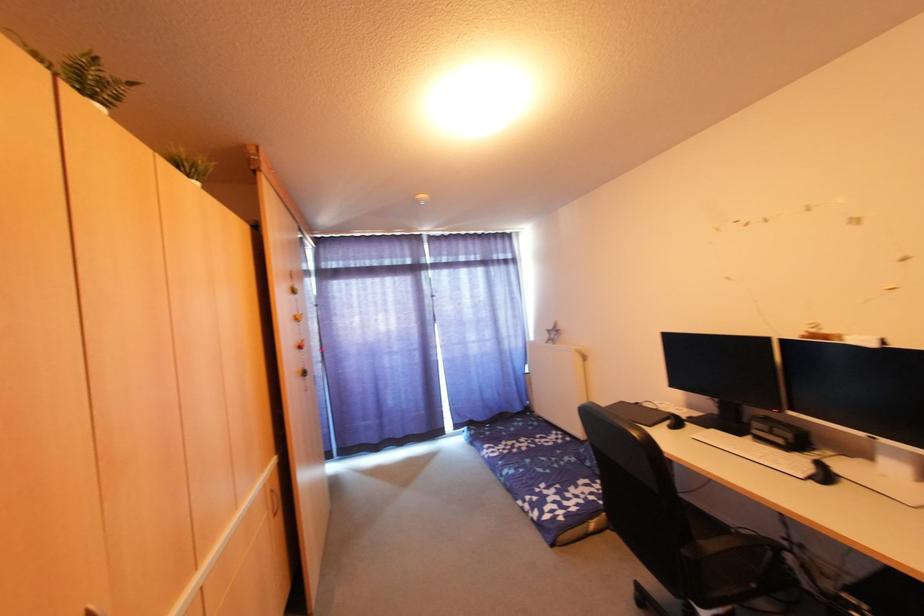
You are a GUI agent. You are given a task and a screenshot of the screen. Output one action in this format:
    pyautogui.click(x=<x>, y=<y>)
    Task: Click on the black chair armrest
    This screenshot has height=616, width=924.
    Given the screenshot: What is the action you would take?
    pyautogui.click(x=732, y=544)